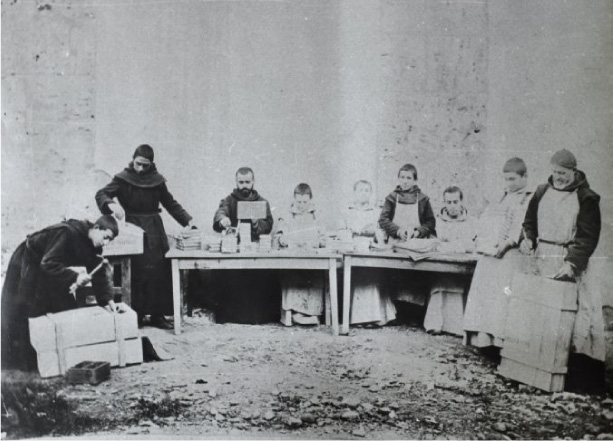
Identify the location of wooden boxes. The height and width of the screenshot is (441, 613). tap(534, 320), tap(113, 350), tap(102, 326).